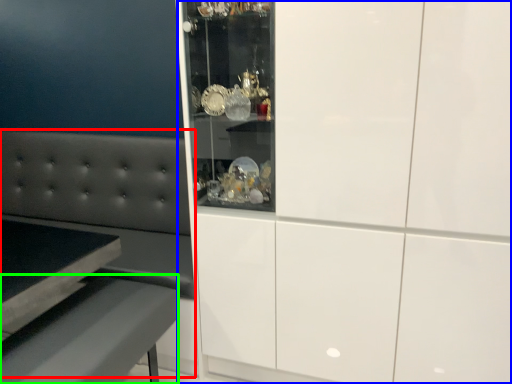
Question: Estimate the real-world distances between objects in this image. Which object is closer to couch (highlighted by a red box), cabinetry (highlighted by a blue box) or table (highlighted by a green box)?

Choices:
 (A) cabinetry
 (B) table

Answer: (B)